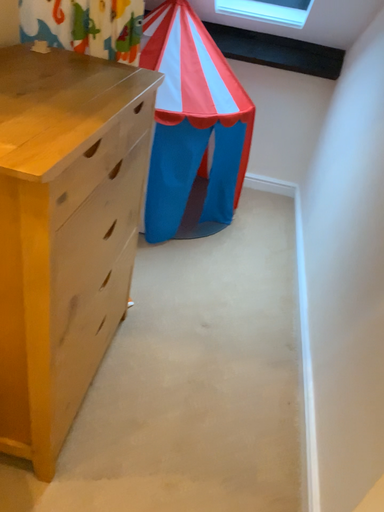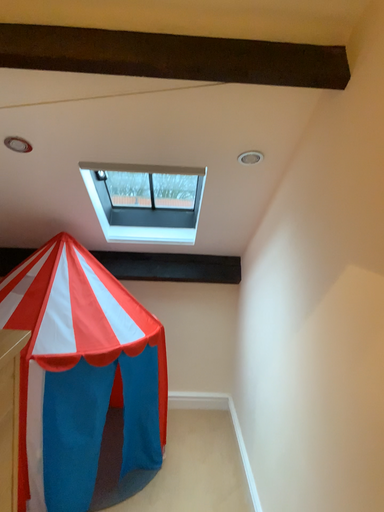
Question: How did the camera likely rotate when shooting the video?

Choices:
 (A) rotated downward
 (B) rotated upward

Answer: (B)